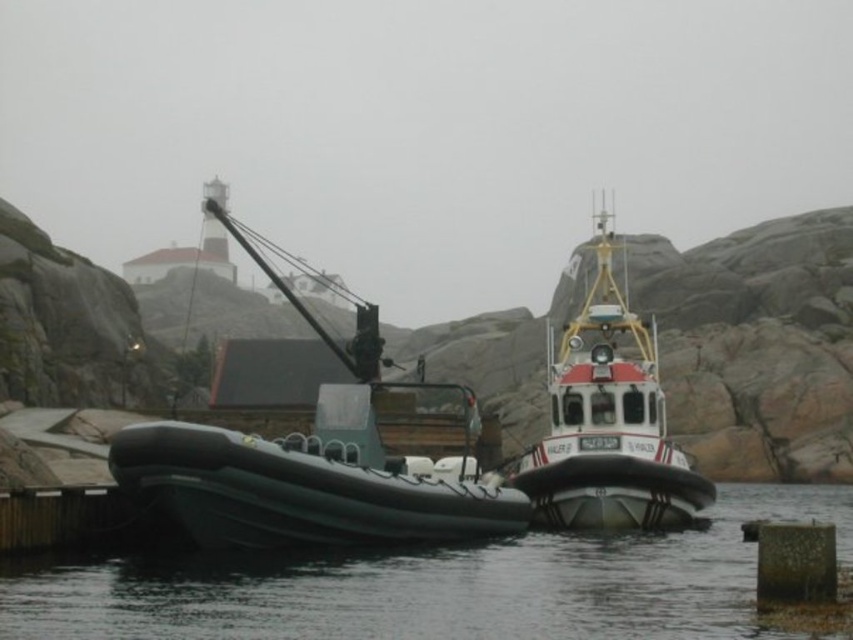
Question: Observing the image, what is the correct spatial positioning of green rubber boat at center in reference to red and white rubber boat at center?

Choices:
 (A) below
 (B) above

Answer: (A)

Question: Can you confirm if black rubber boat at lower left is positioned to the left of red and white rubber boat at center?

Choices:
 (A) yes
 (B) no

Answer: (A)

Question: Which point is closer to the camera?

Choices:
 (A) red and white rubber boat at center
 (B) black rubber boat at lower left

Answer: (B)

Question: Which object is closer to the camera taking this photo?

Choices:
 (A) red and white rubber boat at center
 (B) black rubber boat at lower left
 (C) green rubber boat at center

Answer: (B)

Question: Among these points, which one is farthest from the camera?

Choices:
 (A) (355, 419)
 (B) (366, 557)
 (C) (599, 456)

Answer: (C)

Question: Can you confirm if black rubber boat at lower left is positioned below red and white rubber boat at center?

Choices:
 (A) no
 (B) yes

Answer: (B)